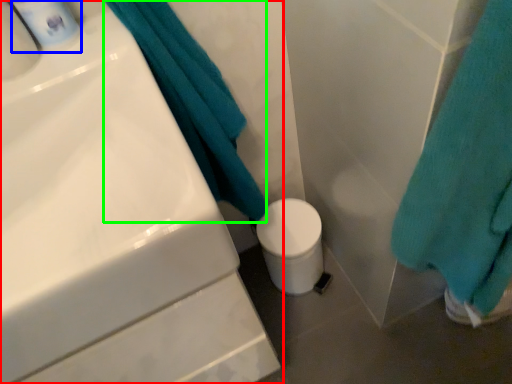
Question: Which object is positioned closest to sink (highlighted by a red box)? Select from mouthwash (highlighted by a blue box) and bath towel (highlighted by a green box).

Choices:
 (A) mouthwash
 (B) bath towel

Answer: (B)